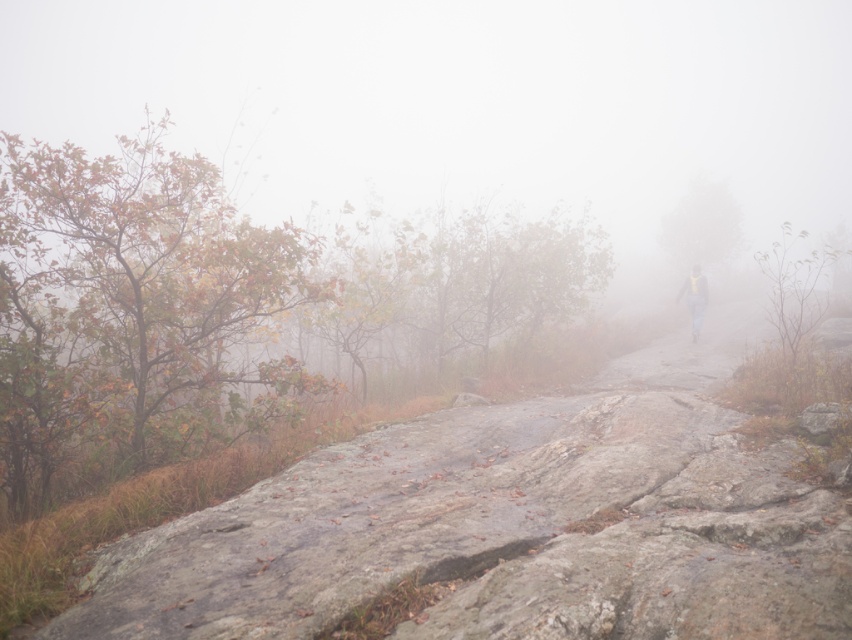
You are a hiker navigating a misty trail and see both the gray rough rock at center and the yellow reflective vest at center ahead. Which object is closer to you?

The gray rough rock at center is closer to you because it is in front of the yellow reflective vest at center.

You are a hiker who has just spotted a gray rough rock at center and a yellow reflective vest at center in the misty landscape. Which object is closer to your current position?

The gray rough rock at center is closer to you because it is located below the yellow reflective vest at center, which suggests it is positioned lower in the visual plane and likely nearer in the three dimensional space.

You are a hiker trying to navigate through the misty landscape. You see a gray rough rock at center and a yellow reflective vest at center. Which object is taller?

The yellow reflective vest at center is taller than the gray rough rock at center.